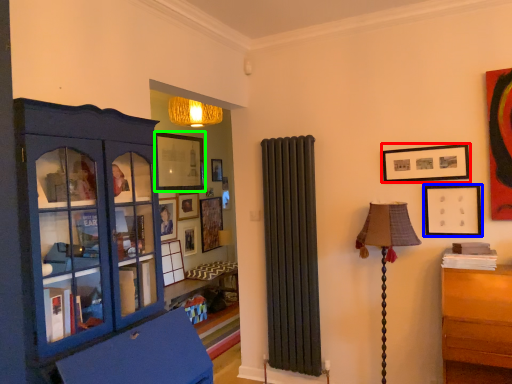
Question: Estimate the real-world distances between objects in this image. Which object is closer to picture frame (highlighted by a red box), picture frame (highlighted by a blue box) or picture frame (highlighted by a green box)?

Choices:
 (A) picture frame
 (B) picture frame

Answer: (A)